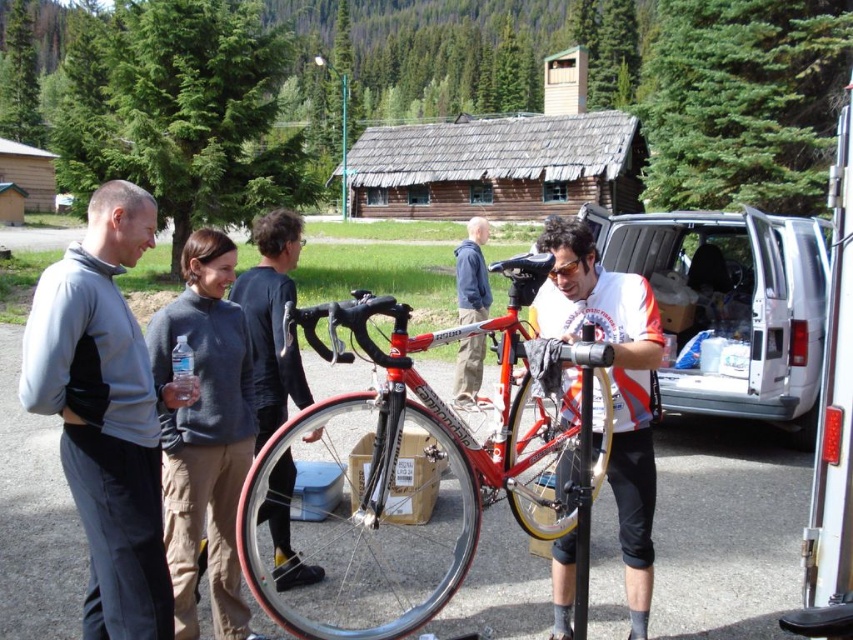
Between gray fleece jacket at left and yellow rubber tire at center, which one has more height?

gray fleece jacket at left is taller.

Does gray fleece jacket at left appear on the right side of yellow rubber tire at center?

No, gray fleece jacket at left is not to the right of yellow rubber tire at center.

Which is in front, point (90, 579) or point (512, 448)?

Point (90, 579) is more forward.

The height and width of the screenshot is (640, 853). What are the coordinates of `gray fleece jacket at left` in the screenshot? It's located at (103, 413).

Can you confirm if gray fleece jacket at left is positioned below matte black bicycle at center?

Yes.

Does gray fleece jacket at left have a lesser width compared to matte black bicycle at center?

Yes, gray fleece jacket at left is thinner than matte black bicycle at center.

Who is more forward, [109,442] or [476,237]?

Point [109,442]

The height and width of the screenshot is (640, 853). I want to click on gray fleece jacket at left, so click(x=103, y=413).

Which is more to the right, gray fleece jacket at left or dark blue sweater at center?

Positioned to the right is dark blue sweater at center.

Between gray fleece jacket at left and dark blue sweater at center, which one is positioned lower?

dark blue sweater at center is lower down.

Image resolution: width=853 pixels, height=640 pixels. Describe the element at coordinates (103, 413) in the screenshot. I see `gray fleece jacket at left` at that location.

Where is `gray fleece jacket at left`? gray fleece jacket at left is located at coordinates (103, 413).